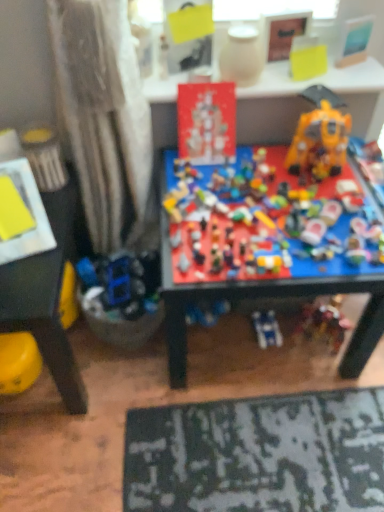
The height and width of the screenshot is (512, 384). In order to click on vacant point above red cardboard sign at upper center, which ranks as the second table in bottom-to-top order (from a real-world perspective) in this screenshot , I will do `click(293, 77)`.